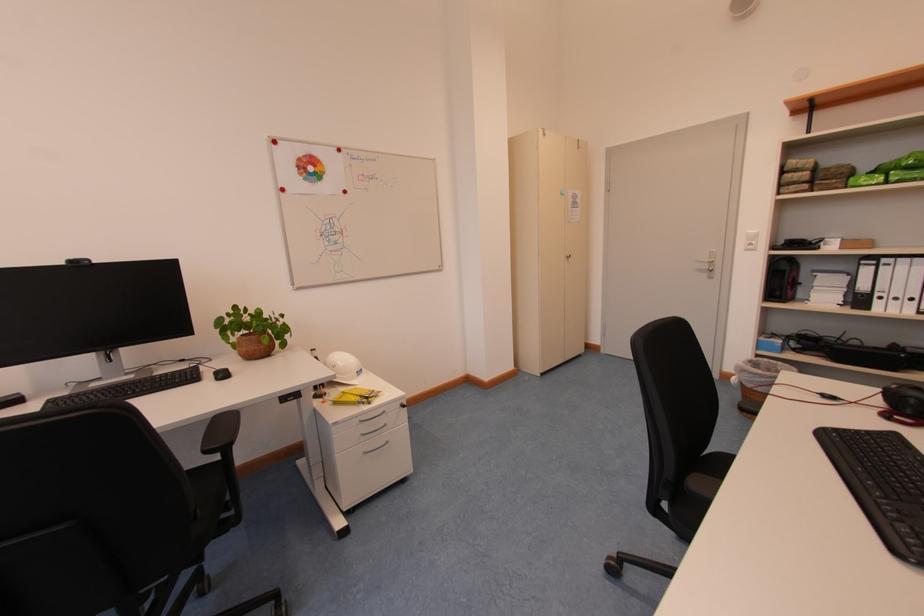
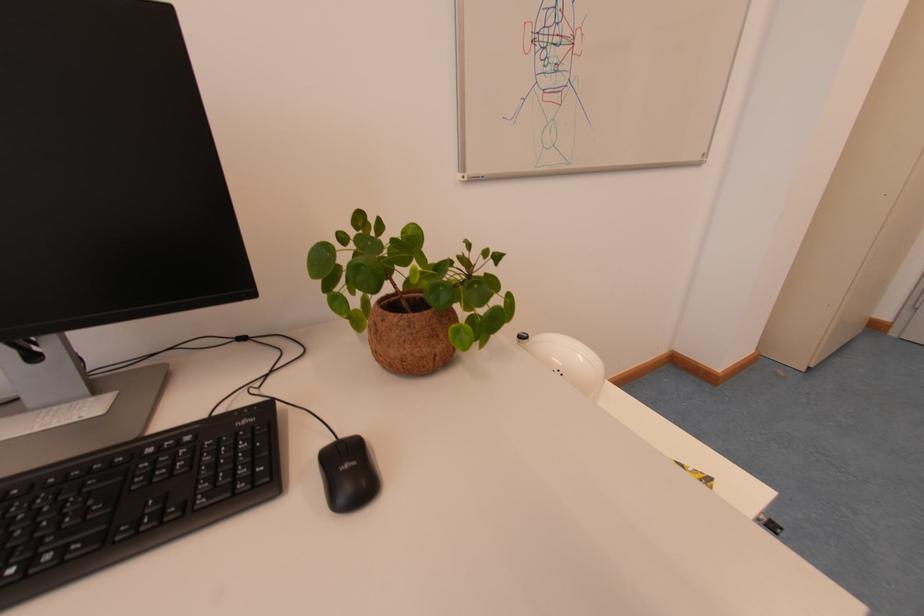
The images are taken continuously from a first-person perspective. In which direction are you moving?

The cameraman walked toward left, forward.